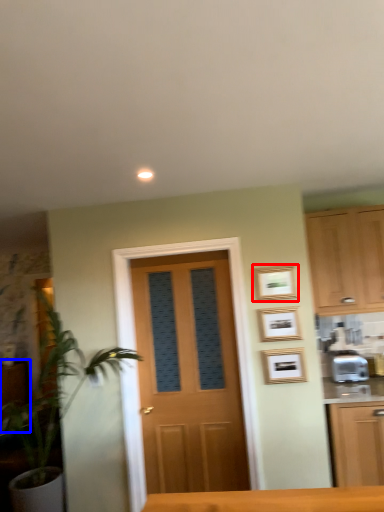
Question: Which object appears closest to the camera in this image, picture frame (highlighted by a red box) or cabinetry (highlighted by a blue box)?

Choices:
 (A) picture frame
 (B) cabinetry

Answer: (A)